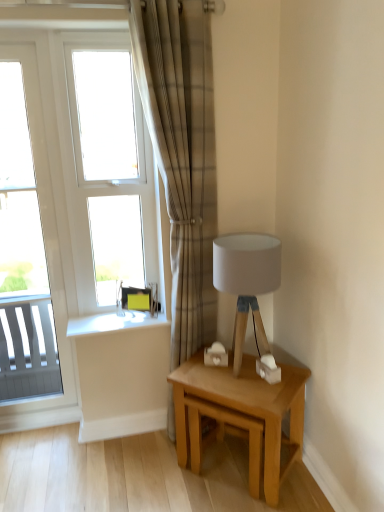
Where is `free space above white glass window at upper left, which is the 1th window in right-to-left order (from a real-world perspective)`? This screenshot has width=384, height=512. free space above white glass window at upper left, which is the 1th window in right-to-left order (from a real-world perspective) is located at coordinates (94, 28).